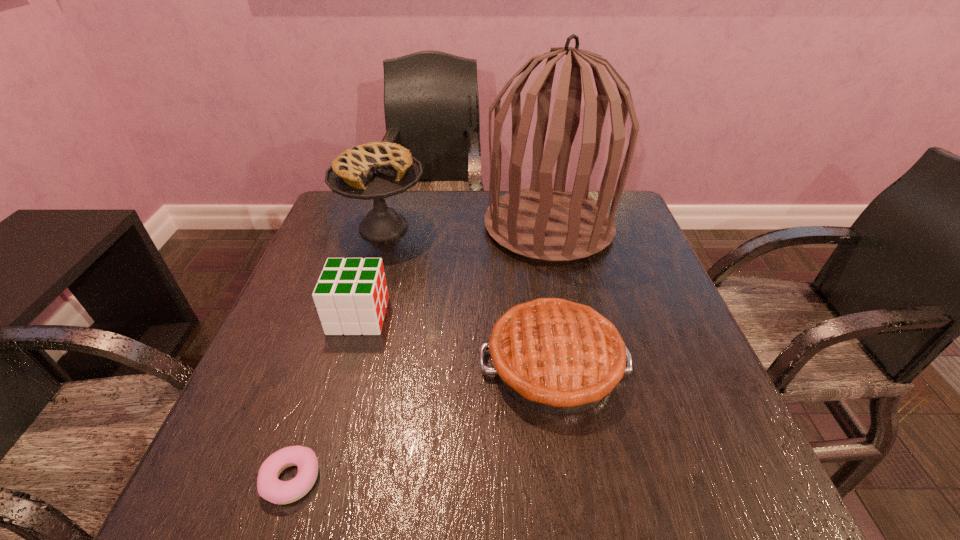
Locate which object is the second closest to the taller pie. Please provide its 2D coordinates. Your answer should be formatted as a tuple, i.e. [(x, y)], where the tuple contains the x and y coordinates of a point satisfying the conditions above.

[(351, 296)]

This screenshot has height=540, width=960. I want to click on vacant space that satisfies the following two spatial constraints: 1. on the red face of the shorter pie; 2. on the left side of the cube, so click(345, 364).

This screenshot has width=960, height=540. I want to click on vacant region that satisfies the following two spatial constraints: 1. on the red face of the shorter pie; 2. on the right side of the cube, so click(x=345, y=364).

What are the coordinates of `free space that satisfies the following two spatial constraints: 1. on the front side of the birdcage; 2. on the red face of the cube` in the screenshot? It's located at (567, 315).

Image resolution: width=960 pixels, height=540 pixels. What are the coordinates of `free space that satisfies the following two spatial constraints: 1. on the cut side of the left pie; 2. on the right side of the right pie` in the screenshot? It's located at (345, 364).